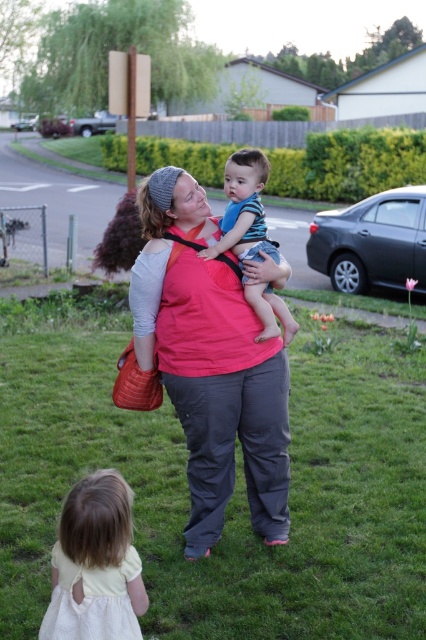
Who is positioned more to the left, green grass at lower center or blue striped shirt at center?

Positioned to the left is blue striped shirt at center.

Is green grass at lower center smaller than blue striped shirt at center?

Correct, green grass at lower center occupies less space than blue striped shirt at center.

Which is behind, point (103, 339) or point (268, 328)?

The point (103, 339) is more distant.

The height and width of the screenshot is (640, 426). What are the coordinates of `green grass at lower center` in the screenshot? It's located at (235, 488).

Is white cotton dress at lower left to the right of blue striped shirt at center from the viewer's perspective?

No, white cotton dress at lower left is not to the right of blue striped shirt at center.

Can you confirm if white cotton dress at lower left is shorter than blue striped shirt at center?

Yes, white cotton dress at lower left is shorter than blue striped shirt at center.

Is point (54, 605) behind point (227, 180)?

No, it is not.

This screenshot has height=640, width=426. I want to click on white cotton dress at lower left, so click(95, 564).

Is matte pink shirt at center thinner than blue striped shirt at center?

No.

Does matte pink shirt at center come in front of blue striped shirt at center?

Yes, matte pink shirt at center is in front of blue striped shirt at center.

What do you see at coordinates (210, 364) in the screenshot? Image resolution: width=426 pixels, height=640 pixels. I see `matte pink shirt at center` at bounding box center [210, 364].

Locate an element on the screen. The height and width of the screenshot is (640, 426). matte pink shirt at center is located at coordinates (210, 364).